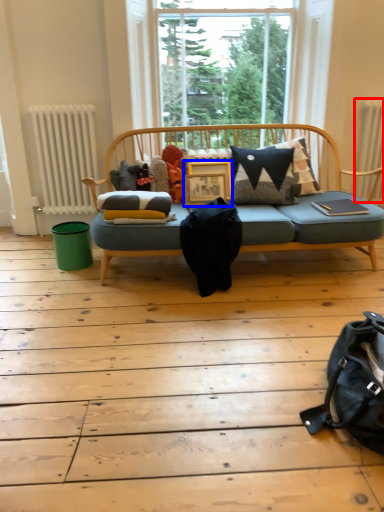
Question: Which point is further to the camera, radiator (highlighted by a red box) or table (highlighted by a blue box)?

Choices:
 (A) radiator
 (B) table

Answer: (A)